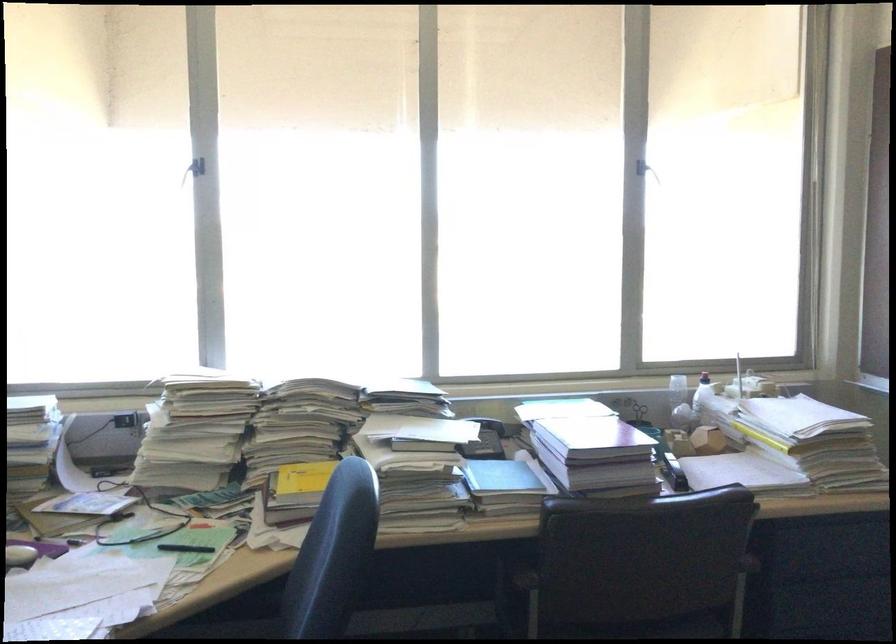
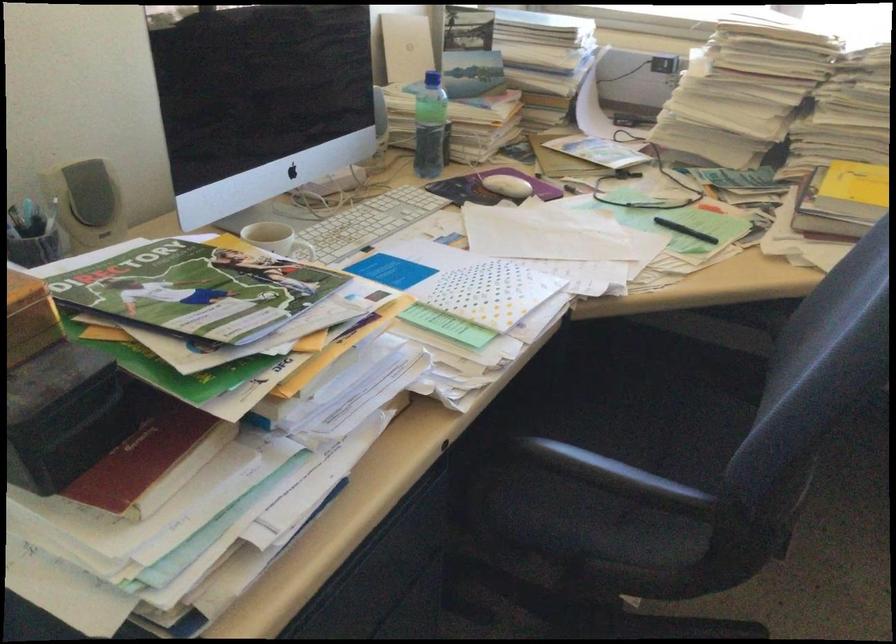
The point at (104, 516) is marked in the first image. Where is the corresponding point in the second image?

(610, 166)